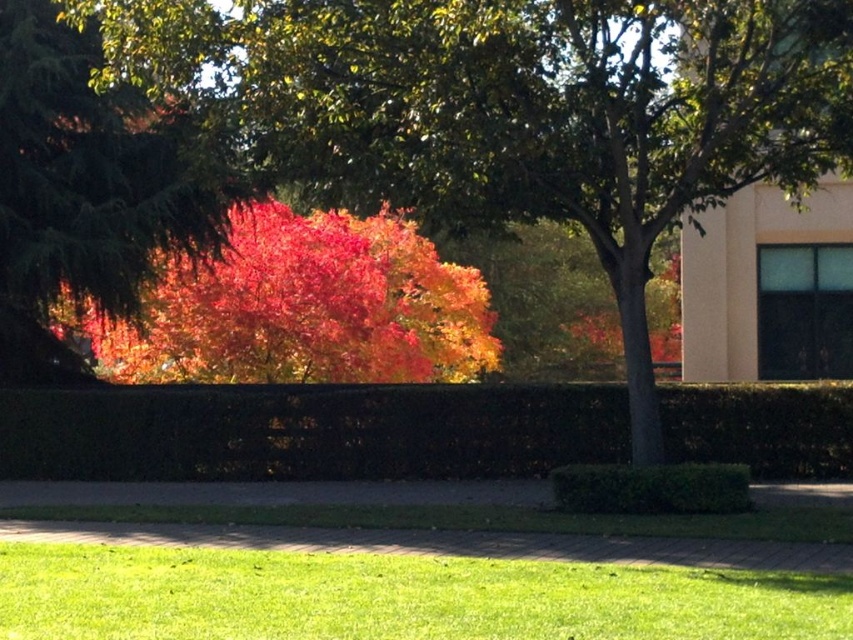
Question: Can you confirm if green grass at lower left is positioned to the left of vivid red leaves at upper left?

Choices:
 (A) yes
 (B) no

Answer: (B)

Question: Which point is farther to the camera?

Choices:
 (A) autumn leaves at center
 (B) vivid red leaves at upper left

Answer: (B)

Question: Where is autumn leaves at center located in relation to vivid red leaves at upper left in the image?

Choices:
 (A) below
 (B) above

Answer: (B)

Question: Estimate the real-world distances between objects in this image. Which object is farther from the vivid red leaves at upper left?

Choices:
 (A) vivid red leaves at left
 (B) green grass at lower left
 (C) autumn leaves at center
 (D) green leafy hedge at center

Answer: (C)

Question: Which of the following is the closest to the observer?

Choices:
 (A) click(546, 634)
 (B) click(90, 268)
 (C) click(387, 125)

Answer: (A)

Question: Can you confirm if autumn leaves at center is bigger than green grass at lower left?

Choices:
 (A) no
 (B) yes

Answer: (A)